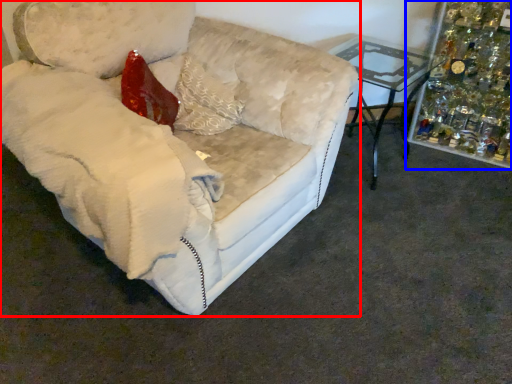
Question: Which object appears closest to the camera in this image, studio couch (highlighted by a red box) or christmas decoration (highlighted by a blue box)?

Choices:
 (A) studio couch
 (B) christmas decoration

Answer: (A)